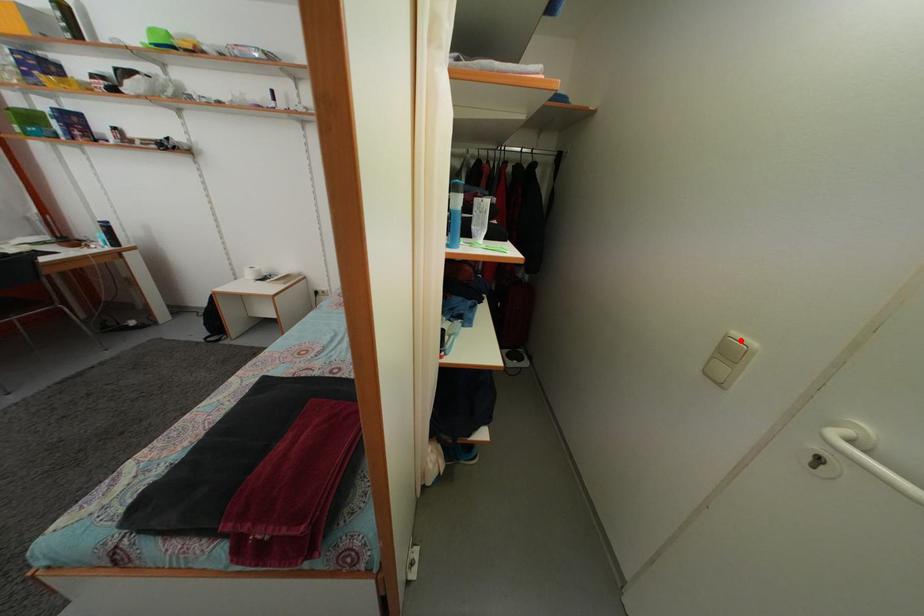
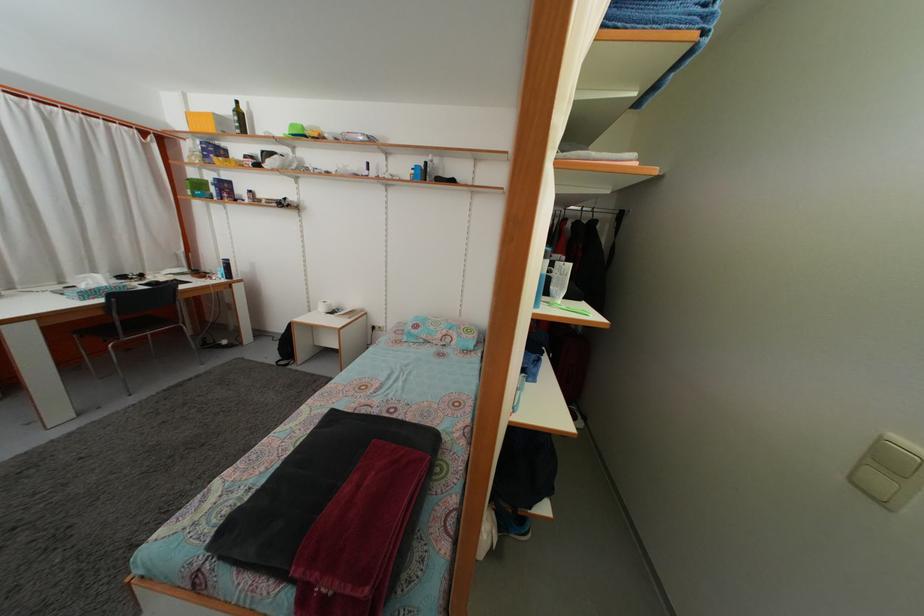
In the second image, find the point that corresponds to the highlighted location in the first image.

(903, 445)